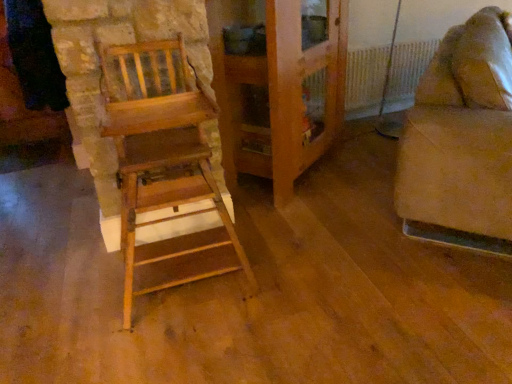
Where is `free spot to the right of wooden chair at left, placed as the 1th furniture when sorted from left to right`? The width and height of the screenshot is (512, 384). free spot to the right of wooden chair at left, placed as the 1th furniture when sorted from left to right is located at coordinates (302, 267).